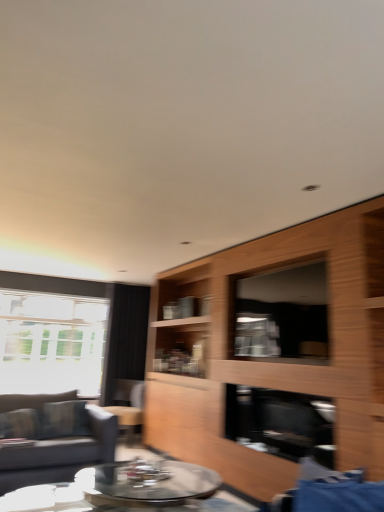
The height and width of the screenshot is (512, 384). Identify the location of dark gray fabric couch at left. (53, 440).

In order to face blue fabric swivel chair at lower right, should I rotate leftwards or rightwards?

It's best to rotate right around 18.476 degrees.

This screenshot has width=384, height=512. What do you see at coordinates (124, 336) in the screenshot? I see `black fabric curtain at left` at bounding box center [124, 336].

This screenshot has width=384, height=512. Describe the element at coordinates (281, 423) in the screenshot. I see `black glass fireplace at center` at that location.

The width and height of the screenshot is (384, 512). What do you see at coordinates (52, 333) in the screenshot?
I see `transparent glass window at left` at bounding box center [52, 333].

Measure the distance between point (52, 484) and camera.

Point (52, 484) is 3.54 meters from camera.

What do you see at coordinates (226, 503) in the screenshot?
I see `clear glass coffee table at center` at bounding box center [226, 503].

Identify the location of dark gray fabric couch at left. The height and width of the screenshot is (512, 384). (53, 440).

From a real-world perspective, is wooden cabinet at center positioned under transparent glass window screen at center based on gravity?

Correct, in the physical world, wooden cabinet at center is lower than transparent glass window screen at center.

Can you confirm if wooden cabinet at center is smaller than transparent glass window screen at center?

Actually, wooden cabinet at center might be larger than transparent glass window screen at center.

Is wooden cabinet at center placed right next to transparent glass window screen at center?

No, wooden cabinet at center is not in contact with transparent glass window screen at center.

From a real-world perspective, between black fabric curtain at left and transparent glass window at left, who is vertically higher?

transparent glass window at left.

Locate an element on the screen. window that is on the left side of black fabric curtain at left is located at coordinates (52, 333).

Does black fabric curtain at left have a lesser width compared to transparent glass window at left?

Correct, the width of black fabric curtain at left is less than that of transparent glass window at left.

Is black fabric curtain at left not near transparent glass window at left?

No, black fabric curtain at left is not far away from transparent glass window at left.

From the image's perspective, is blue fabric swivel chair at lower right over clear glass coffee table at center?

Yes, from the image's perspective, blue fabric swivel chair at lower right is over clear glass coffee table at center.

Find the location of a particular element. swivel chair above the clear glass coffee table at center (from the image's perspective) is located at coordinates (329, 490).

Which is more to the right, blue fabric swivel chair at lower right or clear glass coffee table at center?

Positioned to the right is blue fabric swivel chair at lower right.

Does point (359, 492) come farther from viewer compared to point (89, 506)?

No, (359, 492) is in front of (89, 506).

Consider the image. From a real-world perspective, is black fabric curtain at left positioned above or below blue fabric swivel chair at lower right?

Clearly, from a real-world perspective, black fabric curtain at left is above blue fabric swivel chair at lower right.

Could blue fabric swivel chair at lower right be considered to be inside black fabric curtain at left?

No, blue fabric swivel chair at lower right is not a part of black fabric curtain at left.

You are a GUI agent. You are given a task and a screenshot of the screen. Output one action in this format:
    pyautogui.click(x=<x>, y=<y>)
    Task: Click on the swivel chair that appears on the right of black fabric curtain at left
    The height and width of the screenshot is (512, 384).
    Given the screenshot: What is the action you would take?
    pyautogui.click(x=329, y=490)

Considering the points (101, 403) and (349, 478), which point is in front, point (101, 403) or point (349, 478)?

The point (349, 478) is closer to the camera.

Considering the positions of objects blue fabric swivel chair at lower right and wooden cabinet at center in the image provided, who is more to the left, blue fabric swivel chair at lower right or wooden cabinet at center?

From the viewer's perspective, wooden cabinet at center appears more on the left side.

Considering the relative sizes of blue fabric swivel chair at lower right and wooden cabinet at center in the image provided, is blue fabric swivel chair at lower right smaller than wooden cabinet at center?

Yes.

Is blue fabric swivel chair at lower right inside the boundaries of wooden cabinet at center, or outside?

blue fabric swivel chair at lower right lies outside wooden cabinet at center.

Considering the sizes of objects transparent glass window at left and transparent glass window screen at center in the image provided, who is wider, transparent glass window at left or transparent glass window screen at center?

transparent glass window at left is wider.

Does transparent glass window at left have a lesser height compared to transparent glass window screen at center?

No, transparent glass window at left is not shorter than transparent glass window screen at center.

Relative to transparent glass window screen at center, is transparent glass window at left in front or behind?

transparent glass window at left is behind transparent glass window screen at center.

Which point is more forward, (136, 291) or (60, 426)?

The point (60, 426) is more forward.

Is the position of black fabric curtain at left less distant than that of dark gray fabric couch at left?

No, black fabric curtain at left is behind dark gray fabric couch at left.

Who is taller, black fabric curtain at left or dark gray fabric couch at left?

With more height is black fabric curtain at left.

Considering the positions of objects black fabric curtain at left and dark gray fabric couch at left in the image provided, who is more to the right, black fabric curtain at left or dark gray fabric couch at left?

From the viewer's perspective, black fabric curtain at left appears more on the right side.

Image resolution: width=384 pixels, height=512 pixels. I want to click on window screen that is behind the wooden cabinet at center, so click(283, 314).

Where is `curtain lying below the transparent glass window at left (from the image's perspective)`? This screenshot has height=512, width=384. curtain lying below the transparent glass window at left (from the image's perspective) is located at coordinates click(x=124, y=336).

When comparing their distances from transparent glass window at left, does wooden cabinet at center or dark gray fabric couch at left seem closer?

dark gray fabric couch at left.

Considering their positions, is transparent glass window screen at center positioned further to blue fabric swivel chair at lower right than wooden cabinet at center?

wooden cabinet at center.

When comparing their distances from clear glass coffee table at center, does transparent glass window at left or dark gray fabric couch at left seem closer?

Among the two, dark gray fabric couch at left is located nearer to clear glass coffee table at center.

Which object lies further to the anchor point clear glass coffee table at center, blue fabric swivel chair at lower right or black glass fireplace at center?

The object further to clear glass coffee table at center is blue fabric swivel chair at lower right.

Which object lies further to the anchor point transparent glass window at left, blue fabric swivel chair at lower right or clear glass coffee table at center?

blue fabric swivel chair at lower right is further to transparent glass window at left.

From the image, which object appears to be farther from transparent glass window screen at center, blue fabric swivel chair at lower right or black glass fireplace at center?

blue fabric swivel chair at lower right lies further to transparent glass window screen at center than the other object.

In the scene shown: Based on their spatial positions, is blue fabric swivel chair at lower right or black fabric curtain at left closer to dark gray fabric couch at left?

black fabric curtain at left lies closer to dark gray fabric couch at left than the other object.

Considering their positions, is dark gray fabric couch at left positioned closer to transparent glass window screen at center than blue fabric swivel chair at lower right?

blue fabric swivel chair at lower right is positioned closer to the anchor transparent glass window screen at center.

Image resolution: width=384 pixels, height=512 pixels. What are the coordinates of `window screen positioned between clear glass coffee table at center and transparent glass window at left from near to far` in the screenshot? It's located at (283, 314).

In order to click on fireplace located between clear glass coffee table at center and transparent glass window at left in the depth direction in this screenshot , I will do `click(281, 423)`.

Identify the location of coffee table positioned between wooden cabinet at center and black fabric curtain at left from near to far. (226, 503).

The image size is (384, 512). In order to click on cabinetry between blue fabric swivel chair at lower right and black glass fireplace at center from front to back in this screenshot , I will do `click(274, 354)`.